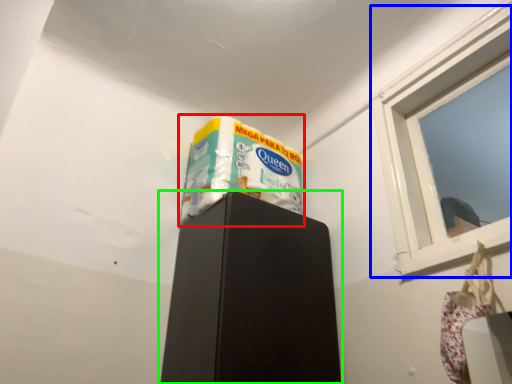
Question: Considering the real-world distances, which object is closest to wrapping paper (highlighted by a red box)? window (highlighted by a blue box) or furniture (highlighted by a green box).

Choices:
 (A) window
 (B) furniture

Answer: (B)